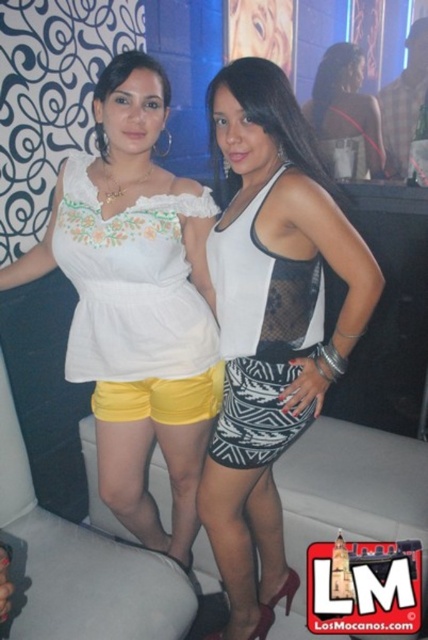
Question: Can you confirm if matte white blouse at center is positioned to the right of yellow fabric shorts at lower center?

Choices:
 (A) no
 (B) yes

Answer: (A)

Question: Which object is closer to the camera taking this photo?

Choices:
 (A) black mesh skirt at center
 (B) matte black dress at center
 (C) white embroidered top at upper left
 (D) white textured skirt at center

Answer: (D)

Question: Which point appears closest to the camera in this image?

Choices:
 (A) (345, 125)
 (B) (107, 120)
 (C) (255, 180)
 (D) (276, 360)

Answer: (D)

Question: Estimate the real-world distances between objects in this image. Which object is closer to the yellow fabric shorts at lower center?

Choices:
 (A) black mesh skirt at center
 (B) matte black dress at center
 (C) white textured skirt at center

Answer: (A)

Question: Does white embroidered top at upper left have a lesser width compared to black mesh skirt at center?

Choices:
 (A) no
 (B) yes

Answer: (A)

Question: Is white textured skirt at center to the left of black mesh skirt at center from the viewer's perspective?

Choices:
 (A) no
 (B) yes

Answer: (A)